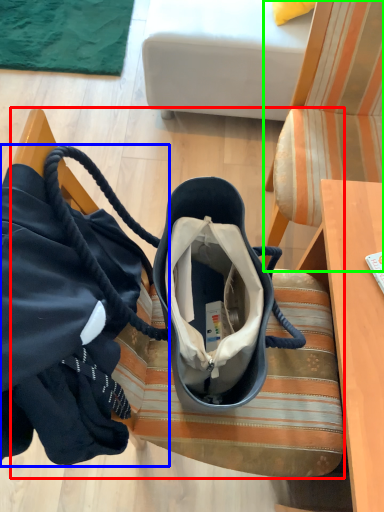
Question: Which object is positioned farthest from furniture (highlighted by a red box)? Select from handbag (highlighted by a blue box) and chair (highlighted by a green box).

Choices:
 (A) handbag
 (B) chair

Answer: (B)